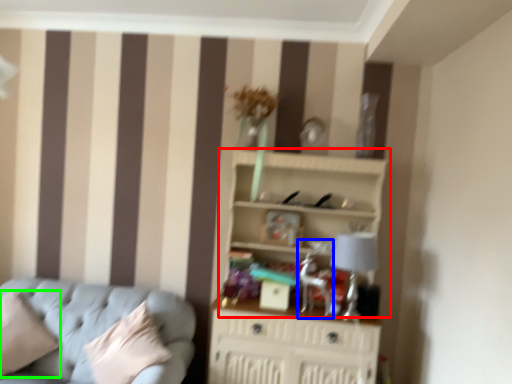
Question: Considering the real-world distances, which object is farthest from shelf (highlighted by a red box)? swivel chair (highlighted by a blue box) or pillow (highlighted by a green box)?

Choices:
 (A) swivel chair
 (B) pillow

Answer: (B)